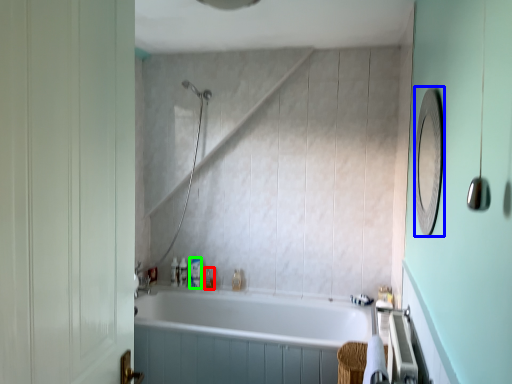
Question: Which object is the farthest from toiletry (highlighted by a red box)? Choose among these: mirror (highlighted by a blue box) or toiletry (highlighted by a green box).

Choices:
 (A) mirror
 (B) toiletry

Answer: (A)